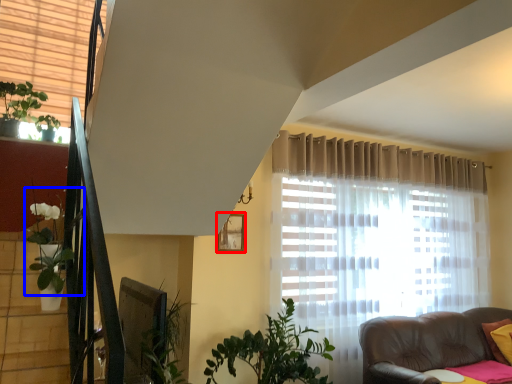
Question: Which point is closer to the camera, picture frame (highlighted by a red box) or plant (highlighted by a blue box)?

Choices:
 (A) picture frame
 (B) plant

Answer: (B)